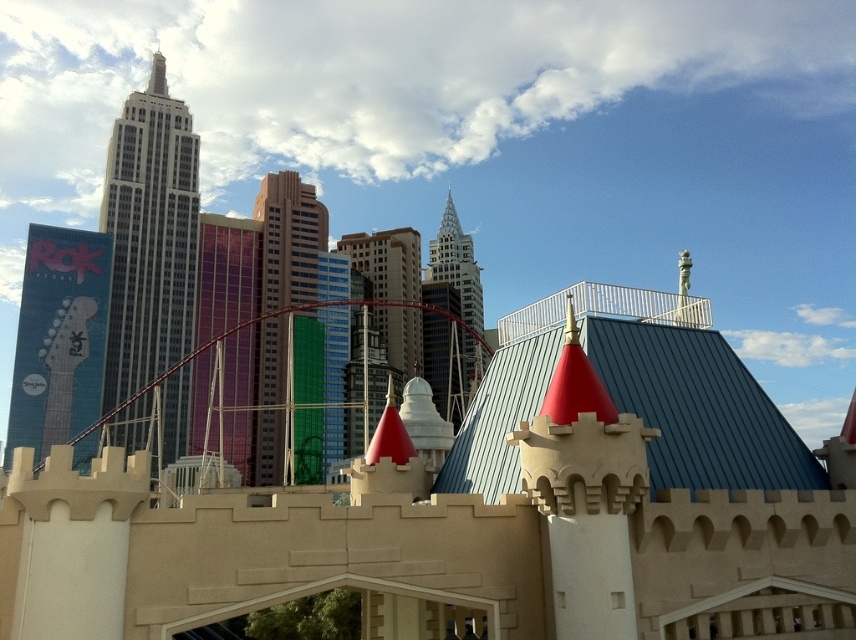
Is green glass building at center above glassy steel tower at center?

Incorrect, green glass building at center is not positioned above glassy steel tower at center.

Can you confirm if green glass building at center is thinner than glassy steel tower at center?

Correct, green glass building at center's width is less than glassy steel tower at center's.

Locate an element on the screen. This screenshot has width=856, height=640. green glass building at center is located at coordinates [289, 237].

Based on the photo, which is more to the left, white glass skyscraper at upper left or glassy steel tower at center?

white glass skyscraper at upper left is more to the left.

Is white glass skyscraper at upper left further to camera compared to glassy steel tower at center?

No, white glass skyscraper at upper left is closer to the viewer.

I want to click on white glass skyscraper at upper left, so click(149, 236).

Which is more to the right, white glass skyscraper at upper left or metallic guitar at left?

white glass skyscraper at upper left is more to the right.

Is point (169, 285) positioned before point (42, 273)?

No.

Between point (163, 419) and point (43, 317), which one is positioned in front?

Point (43, 317)

Identify the location of white glass skyscraper at upper left. pyautogui.click(x=149, y=236).